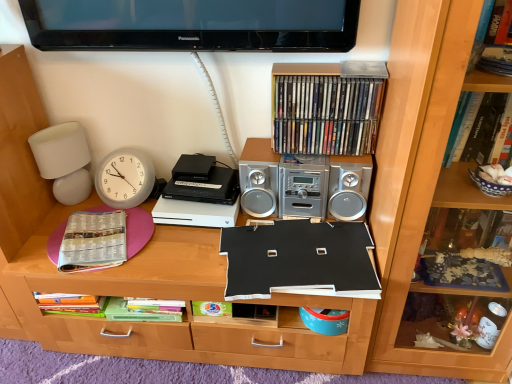
You are a GUI agent. You are given a task and a screenshot of the screen. Output one action in this format:
    pyautogui.click(x=<x>, y=<y>)
    Task: Click on the vacant point above black matte paper at center, arranged as the 1th paperback book when viewed from the right (from a real-world perspective)
    The height and width of the screenshot is (384, 512).
    Given the screenshot: What is the action you would take?
    pyautogui.click(x=300, y=266)